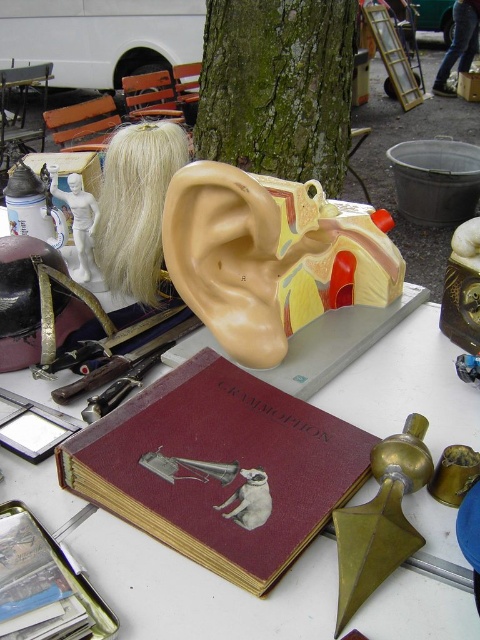
You are a customer at a flea market and see the beige rubber ear at center and the green rough bark tree at center. Which object is closer to you?

The beige rubber ear at center is closer to you because it is in front of the green rough bark tree at center.

You are an antique collector examining items at a flea market. You see the beige rubber ear at center and the green rough bark tree at center. Which item has a smaller width?

The beige rubber ear at center is thinner than the green rough bark tree at center, so the beige rubber ear at center has a smaller width.